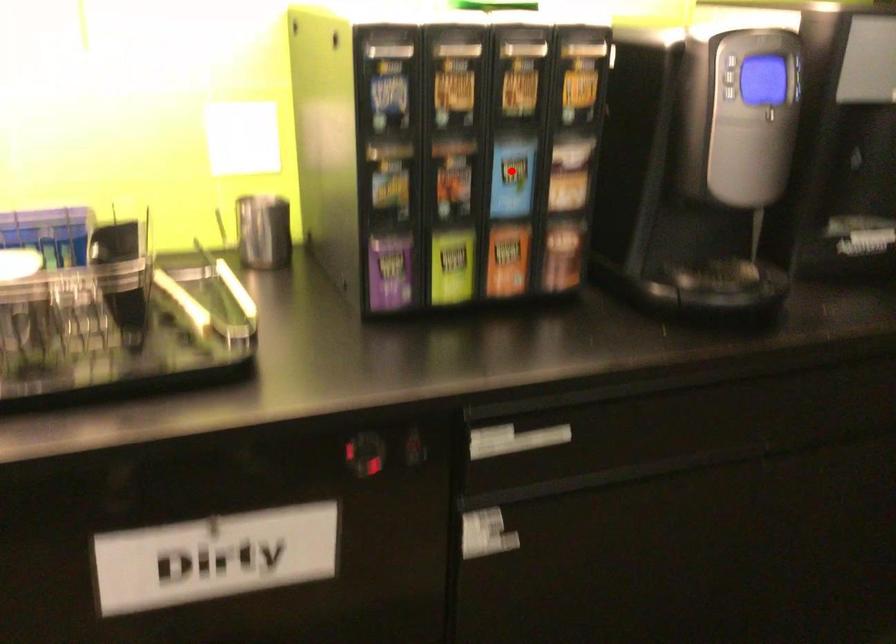
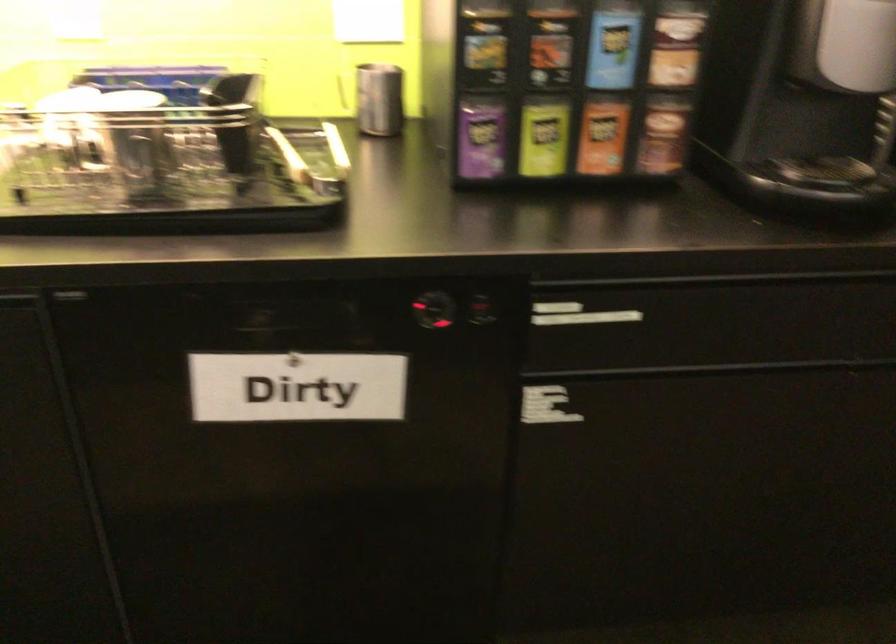
The point at the highlighted location is marked in the first image. Where is the corresponding point in the second image?

(613, 44)